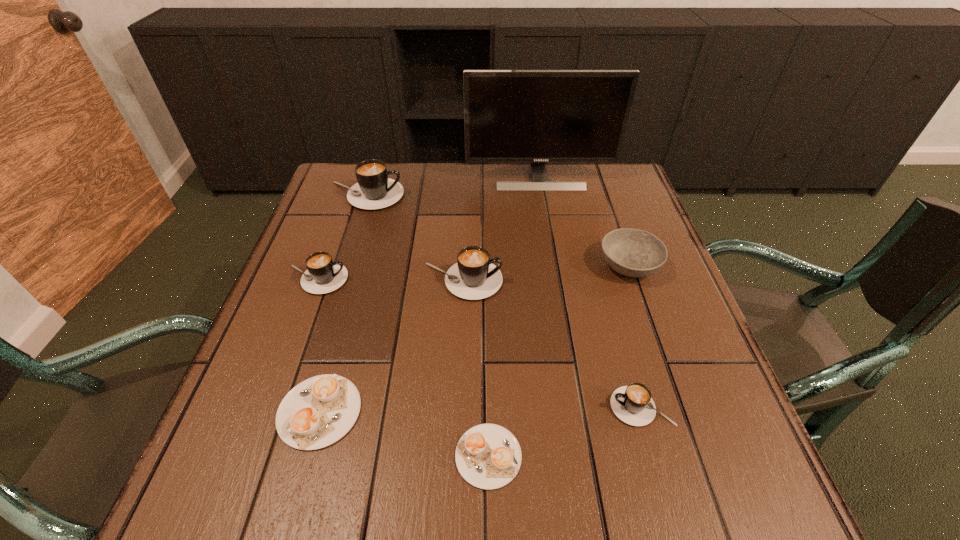
Where is `free spot between the biggest black cappuccino and the monitor`? This screenshot has width=960, height=540. free spot between the biggest black cappuccino and the monitor is located at coordinates (452, 187).

I want to click on vacant space that's between the biggest black cappuccino and the left white cappuccino, so click(x=343, y=303).

You are a GUI agent. You are given a task and a screenshot of the screen. Output one action in this format:
    pyautogui.click(x=<x>, y=<y>)
    Task: Click on the free area in between the tallest object and the second shortest object
    This screenshot has width=960, height=540.
    Given the screenshot: What is the action you would take?
    click(429, 294)

What are the coordinates of `free space between the rightmost black cappuccino and the tallest object` in the screenshot? It's located at (590, 292).

I want to click on blank region between the second smallest black cappuccino and the tallest object, so click(x=428, y=228).

Point out which object is positioned as the fifth nearest to the fifth tallest cappuccino. Please provide its 2D coordinates. Your answer should be formatted as a tuple, i.e. [(x, y)], where the tuple contains the x and y coordinates of a point satisfying the conditions above.

[(374, 190)]

Locate which object ranks fourth in proximity to the third tallest object. Please provide its 2D coordinates. Your answer should be formatted as a tuple, i.e. [(x, y)], where the tuple contains the x and y coordinates of a point satisfying the conditions above.

[(631, 252)]

Where is `the second closest cappuccino to the bowl`? the second closest cappuccino to the bowl is located at coordinates (632, 404).

Identify which cappuccino is located as the third nearest to the third tallest cappuccino. Please provide its 2D coordinates. Your answer should be formatted as a tuple, i.e. [(x, y)], where the tuple contains the x and y coordinates of a point satisfying the conditions above.

[(319, 411)]

This screenshot has height=540, width=960. Identify the location of the closest black cappuccino to the sixth shortest object. (322, 276).